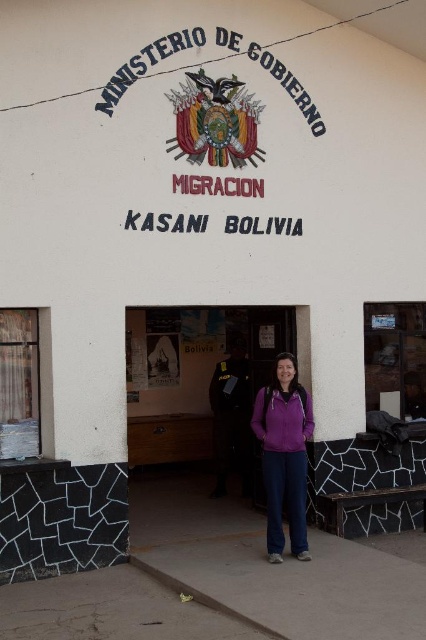
Question: Which of the following is the farthest from the observer?

Choices:
 (A) (302, 548)
 (B) (206, 451)

Answer: (B)

Question: Which object is farther from the camera taking this photo?

Choices:
 (A) purple fleece jacket at center
 (B) wooden door at center
 (C) black leather jacket at center

Answer: (B)

Question: Does wooden door at center lie behind black leather jacket at center?

Choices:
 (A) yes
 (B) no

Answer: (A)

Question: In this image, where is wooden door at center located relative to purple fleece jacket at center?

Choices:
 (A) above
 (B) below

Answer: (A)

Question: Can you confirm if wooden door at center is bigger than black leather jacket at center?

Choices:
 (A) no
 (B) yes

Answer: (B)

Question: Which of the following is the farthest from the observer?

Choices:
 (A) black leather jacket at center
 (B) wooden door at center
 (C) purple fleece jacket at center

Answer: (B)